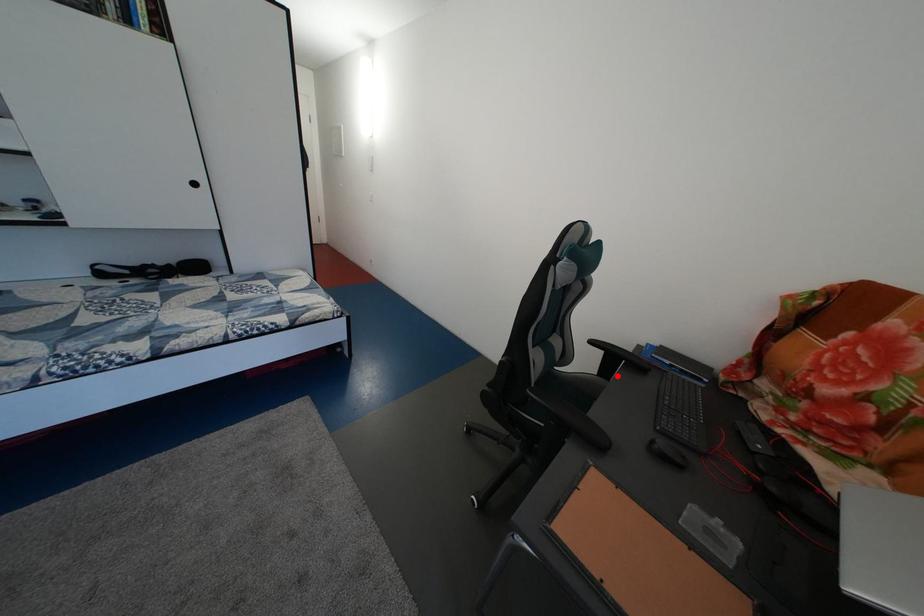
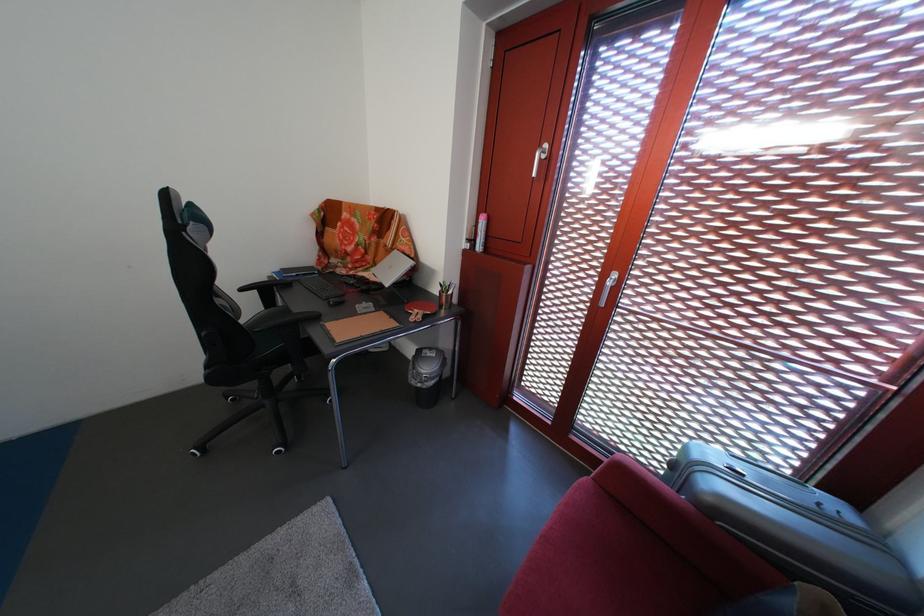
The point at the highlighted location is marked in the first image. Where is the corresponding point in the second image?

(280, 308)